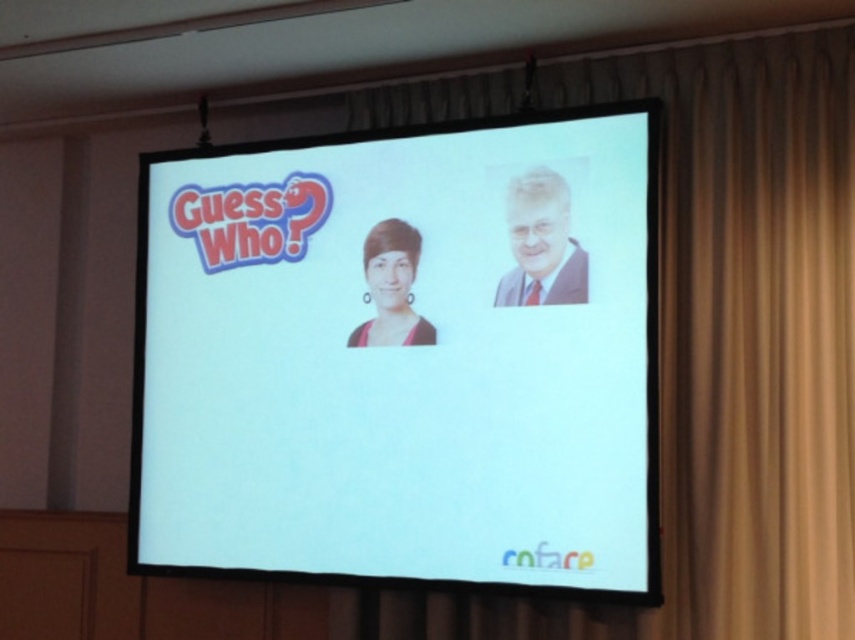
Question: Which point is closer to the camera?

Choices:
 (A) (555, 284)
 (B) (470, 548)

Answer: (A)

Question: Is white glossy screen at center closer to camera compared to matte gray suit at upper right?

Choices:
 (A) yes
 (B) no

Answer: (A)

Question: Considering the real-world distances, which object is closest to the beige fabric curtain at upper center?

Choices:
 (A) white glossy screen at center
 (B) matte gray suit at upper right

Answer: (A)

Question: Which point appears closest to the camera in this image?

Choices:
 (A) (814, 346)
 (B) (531, 456)
 (C) (578, 285)

Answer: (A)

Question: Observing the image, what is the correct spatial positioning of white glossy screen at center in reference to beige fabric curtain at upper center?

Choices:
 (A) below
 (B) above

Answer: (A)

Question: Can you confirm if white glossy screen at center is positioned to the right of matte gray suit at upper right?

Choices:
 (A) no
 (B) yes

Answer: (A)